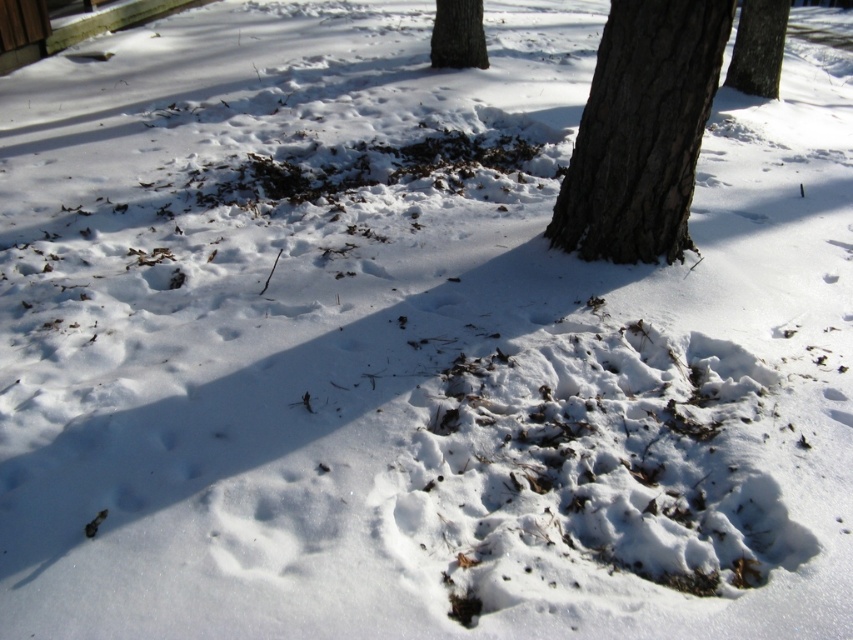
You are standing in the snowy area and want to walk towards the dark brown bark tree at center. Which direction should you walk relative to the brown rough bark tree at upper center?

You should walk to the right side of the brown rough bark tree at upper center because the dark brown bark tree at center is positioned on the right side of it.